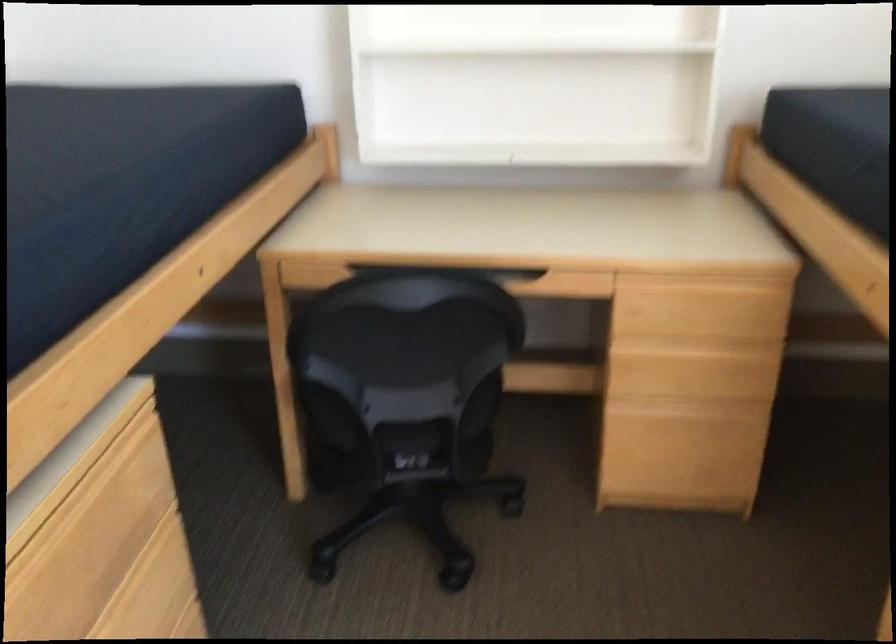
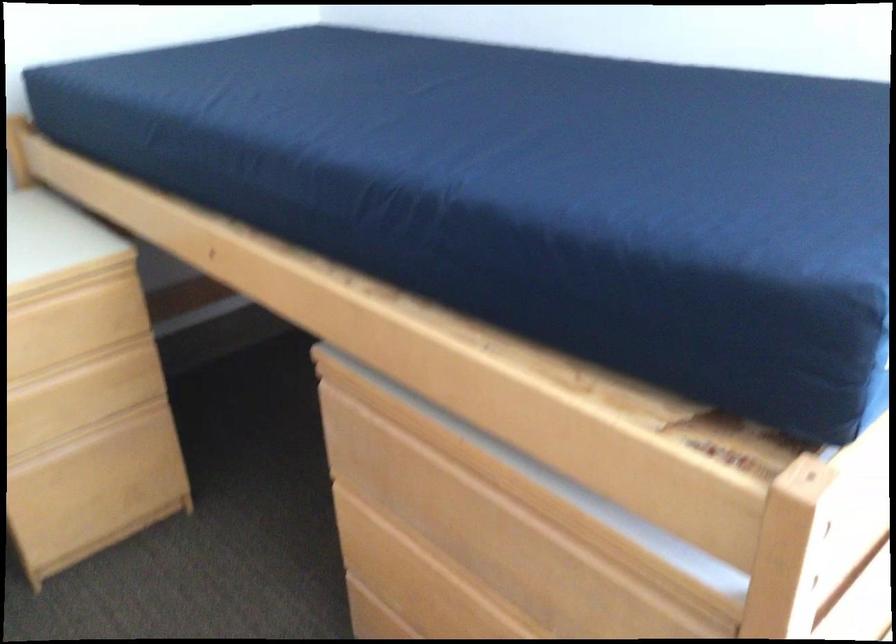
The point at (676, 375) is marked in the first image. Where is the corresponding point in the second image?

(65, 410)